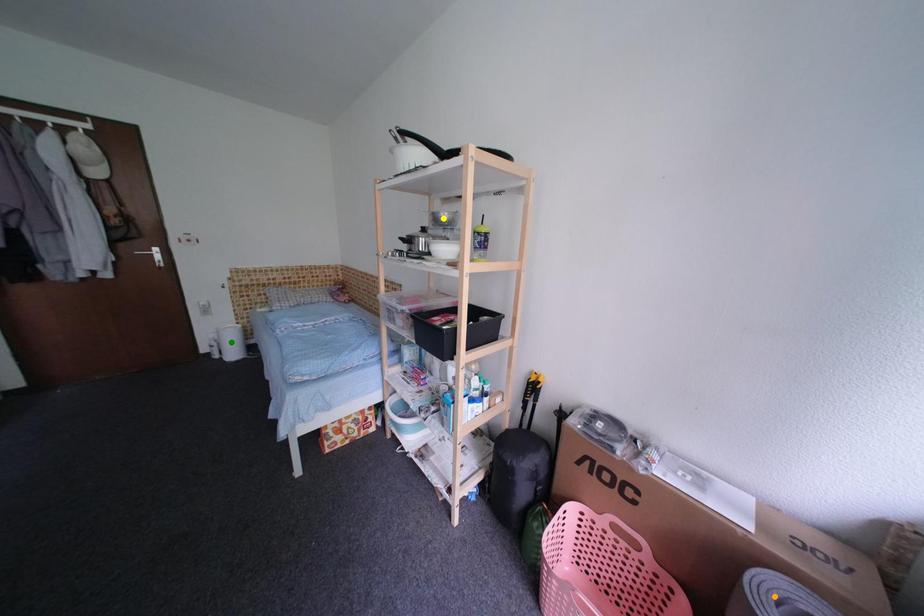
Order these from nearest to farthest:
A) orange point
B) green point
C) yellow point

1. green point
2. yellow point
3. orange point